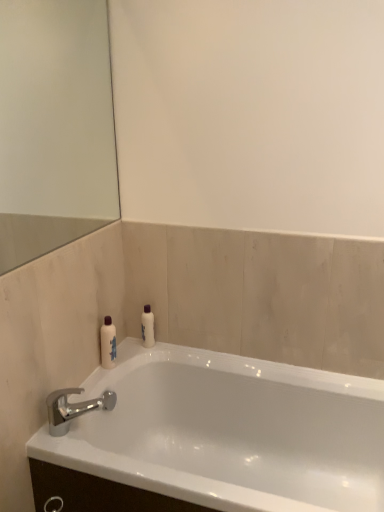
You are a GUI agent. You are given a task and a screenshot of the screen. Output one action in this format:
    pyautogui.click(x=<x>, y=<y>)
    Task: Click on the white glossy bottle at left, the first toiletry in the left-to-right sequence
    Image resolution: width=384 pixels, height=512 pixels.
    Given the screenshot: What is the action you would take?
    pyautogui.click(x=108, y=344)

Describe the element at coordinates (229, 432) in the screenshot. I see `white glossy bathtub at lower left` at that location.

Describe the element at coordinates (147, 327) in the screenshot. Image resolution: width=384 pixels, height=512 pixels. I see `white glossy bottle at upper center, the first toiletry positioned from the right` at that location.

Image resolution: width=384 pixels, height=512 pixels. What are the coordinates of `white glossy bottle at upper center, which ranks as the 2th toiletry in left-to-right order` in the screenshot? It's located at (147, 327).

You are a GUI agent. You are given a task and a screenshot of the screen. Output one action in this format:
    pyautogui.click(x=<x>, y=<y>)
    Task: Click on the white glossy bottle at left, which is the 2th toiletry from back to front
    
    Given the screenshot: What is the action you would take?
    pyautogui.click(x=108, y=344)

Identify the location of bathtub on the right of the chrome metallic faucet at lower left. (229, 432).

Could you tell me if white glossy bathtub at lower left is facing chrome metallic faucet at lower left?

No, white glossy bathtub at lower left is not turned towards chrome metallic faucet at lower left.

From a real-world perspective, does white glossy bathtub at lower left stand above chrome metallic faucet at lower left?

No, from a real-world perspective, white glossy bathtub at lower left is not on top of chrome metallic faucet at lower left.

Is white glossy bathtub at lower left to the left of chrome metallic faucet at lower left from the viewer's perspective?

No, white glossy bathtub at lower left is not to the left of chrome metallic faucet at lower left.

From a real-world perspective, is white glossy bottle at upper center, which ranks as the 2th toiletry in left-to-right order, on white glossy bottle at left, the first toiletry in the left-to-right sequence?

No, from a real-world perspective, white glossy bottle at upper center, which ranks as the 2th toiletry in left-to-right order, is not on top of white glossy bottle at left, the first toiletry in the left-to-right sequence.

Relative to white glossy bottle at left, which appears as the 1th toiletry when viewed from the front, is white glossy bottle at upper center, which ranks as the 2th toiletry in left-to-right order, in front or behind?

Visually, white glossy bottle at upper center, which ranks as the 2th toiletry in left-to-right order, is located behind white glossy bottle at left, which appears as the 1th toiletry when viewed from the front.

Can you confirm if white glossy bottle at upper center, arranged as the 2th toiletry when viewed from the front, is positioned to the right of white glossy bottle at left, which appears as the 1th toiletry when viewed from the front?

Indeed, white glossy bottle at upper center, arranged as the 2th toiletry when viewed from the front, is positioned on the right side of white glossy bottle at left, which appears as the 1th toiletry when viewed from the front.

Who is bigger, white glossy bottle at upper center, the first toiletry positioned from the right, or white glossy bottle at left, which is the 2th toiletry from back to front?

white glossy bottle at left, which is the 2th toiletry from back to front, is bigger.

Is there a large distance between white glossy bathtub at lower left and white glossy bottle at upper center, the first toiletry positioned from the back?

They are positioned close to each other.

From the image's perspective, would you say white glossy bathtub at lower left is shown under white glossy bottle at upper center, the first toiletry positioned from the back?

Correct, white glossy bathtub at lower left appears lower than white glossy bottle at upper center, the first toiletry positioned from the back, in the image.

Can you confirm if white glossy bathtub at lower left is wider than white glossy bottle at upper center, arranged as the 2th toiletry when viewed from the front?

Yes, white glossy bathtub at lower left is wider than white glossy bottle at upper center, arranged as the 2th toiletry when viewed from the front.

Is white glossy bathtub at lower left taller or shorter than white glossy bottle at upper center, the first toiletry positioned from the right?

Considering their sizes, white glossy bathtub at lower left has more height than white glossy bottle at upper center, the first toiletry positioned from the right.

Which is closer to the camera, (75, 388) or (147, 312)?

Point (75, 388) appears to be closer to the viewer than point (147, 312).

Measure the distance from chrome metallic faucet at lower left to white glossy bottle at upper center, arranged as the 2th toiletry when viewed from the front.

16.39 inches.

Choose the correct answer: Is chrome metallic faucet at lower left inside white glossy bottle at upper center, which ranks as the 2th toiletry in left-to-right order, or outside it?

chrome metallic faucet at lower left is spatially situated outside white glossy bottle at upper center, which ranks as the 2th toiletry in left-to-right order.

This screenshot has width=384, height=512. What are the coordinates of `tap below the white glossy bottle at upper center, the first toiletry positioned from the back (from the image's perspective)` in the screenshot? It's located at (73, 408).

Image resolution: width=384 pixels, height=512 pixels. Identify the location of the 1st toiletry behind the chrome metallic faucet at lower left. (108, 344).

Which is nearer, (x=109, y=328) or (x=95, y=406)?

The point (x=95, y=406) is in front.

Is the position of white glossy bottle at left, which is the 2th toiletry from back to front, more distant than that of chrome metallic faucet at lower left?

Yes, it is behind chrome metallic faucet at lower left.

Is white glossy bottle at left, which appears as the 1th toiletry when viewed from the front, not within chrome metallic faucet at lower left?

That's correct, white glossy bottle at left, which appears as the 1th toiletry when viewed from the front, is outside of chrome metallic faucet at lower left.

Is white glossy bottle at upper center, arranged as the 2th toiletry when viewed from the front, oriented away from white glossy bathtub at lower left?

No.

Is white glossy bottle at upper center, arranged as the 2th toiletry when viewed from the front, not inside white glossy bathtub at lower left?

Indeed, white glossy bottle at upper center, arranged as the 2th toiletry when viewed from the front, is completely outside white glossy bathtub at lower left.

From the picture: Looking at their sizes, would you say white glossy bottle at upper center, arranged as the 2th toiletry when viewed from the front, is wider or thinner than white glossy bathtub at lower left?

Considering their sizes, white glossy bottle at upper center, arranged as the 2th toiletry when viewed from the front, looks slimmer than white glossy bathtub at lower left.

Are white glossy bottle at upper center, the first toiletry positioned from the right, and white glossy bathtub at lower left making contact?

No, white glossy bottle at upper center, the first toiletry positioned from the right, is not with white glossy bathtub at lower left.

Between white glossy bottle at left, the first toiletry in the left-to-right sequence, and white glossy bottle at upper center, the first toiletry positioned from the back, which one appears on the right side from the viewer's perspective?

Result: Positioned to the right is white glossy bottle at upper center, the first toiletry positioned from the back.

Is white glossy bottle at upper center, which ranks as the 2th toiletry in left-to-right order, at the back of white glossy bottle at left, which is the 2th toiletry from back to front?

No, white glossy bottle at left, which is the 2th toiletry from back to front,'s orientation is not away from white glossy bottle at upper center, which ranks as the 2th toiletry in left-to-right order.

What's the angular difference between white glossy bottle at left, which appears as the 1th toiletry when viewed from the front, and white glossy bottle at upper center, which ranks as the 2th toiletry in left-to-right order,'s facing directions?

They differ by 86.6 degrees in their facing directions.

Between point (108, 329) and point (148, 347), which one is positioned behind?

The point (148, 347) is farther from the camera.

The height and width of the screenshot is (512, 384). Find the location of `bathtub below the chrome metallic faucet at lower left (from a real-world perspective)`. bathtub below the chrome metallic faucet at lower left (from a real-world perspective) is located at coordinates (229, 432).

This screenshot has width=384, height=512. Identify the location of toiletry above the white glossy bottle at upper center, the first toiletry positioned from the right (from a real-world perspective). (108, 344).

Estimate the real-world distances between objects in this image. Which object is further from white glossy bottle at left, which is the 2th toiletry from back to front, white glossy bathtub at lower left or chrome metallic faucet at lower left?

white glossy bathtub at lower left is positioned further to the anchor white glossy bottle at left, which is the 2th toiletry from back to front.

Based on the photo, based on their spatial positions, is white glossy bathtub at lower left or white glossy bottle at left, the 2th toiletry when ordered from right to left, further from white glossy bottle at upper center, which ranks as the 2th toiletry in left-to-right order?

white glossy bathtub at lower left.

Based on their spatial positions, is white glossy bathtub at lower left or white glossy bottle at upper center, the first toiletry positioned from the right, further from chrome metallic faucet at lower left?

Based on the image, white glossy bottle at upper center, the first toiletry positioned from the right, appears to be further to chrome metallic faucet at lower left.

Which object lies nearer to the anchor point white glossy bottle at upper center, which ranks as the 2th toiletry in left-to-right order, chrome metallic faucet at lower left or white glossy bathtub at lower left?

The object closer to white glossy bottle at upper center, which ranks as the 2th toiletry in left-to-right order, is chrome metallic faucet at lower left.

Which object lies nearer to the anchor point chrome metallic faucet at lower left, white glossy bottle at upper center, arranged as the 2th toiletry when viewed from the front, or white glossy bottle at left, the 2th toiletry when ordered from right to left?

white glossy bottle at left, the 2th toiletry when ordered from right to left.

Which object lies nearer to the anchor point chrome metallic faucet at lower left, white glossy bottle at left, which appears as the 1th toiletry when viewed from the front, or white glossy bottle at upper center, the first toiletry positioned from the right?

white glossy bottle at left, which appears as the 1th toiletry when viewed from the front, is closer to chrome metallic faucet at lower left.

Based on their spatial positions, is white glossy bottle at upper center, the first toiletry positioned from the right, or white glossy bathtub at lower left closer to white glossy bottle at left, the first toiletry in the left-to-right sequence?

white glossy bottle at upper center, the first toiletry positioned from the right, is closer to white glossy bottle at left, the first toiletry in the left-to-right sequence.

Estimate the real-world distances between objects in this image. Which object is further from white glossy bathtub at lower left, white glossy bottle at left, the first toiletry in the left-to-right sequence, or white glossy bottle at upper center, the first toiletry positioned from the back?

The object further to white glossy bathtub at lower left is white glossy bottle at upper center, the first toiletry positioned from the back.

Where is `toiletry between white glossy bathtub at lower left and white glossy bottle at upper center, the first toiletry positioned from the back, along the z-axis`? The image size is (384, 512). toiletry between white glossy bathtub at lower left and white glossy bottle at upper center, the first toiletry positioned from the back, along the z-axis is located at coordinates point(108,344).

Where is `tap positioned between white glossy bathtub at lower left and white glossy bottle at upper center, arranged as the 2th toiletry when viewed from the front, from near to far`? This screenshot has height=512, width=384. tap positioned between white glossy bathtub at lower left and white glossy bottle at upper center, arranged as the 2th toiletry when viewed from the front, from near to far is located at coordinates (73, 408).

Identify the location of tap between white glossy bathtub at lower left and white glossy bottle at left, which is the 2th toiletry from back to front, from front to back. (73, 408).

Image resolution: width=384 pixels, height=512 pixels. In order to click on toiletry positioned between chrome metallic faucet at lower left and white glossy bottle at upper center, which ranks as the 2th toiletry in left-to-right order, from near to far in this screenshot , I will do `click(108, 344)`.